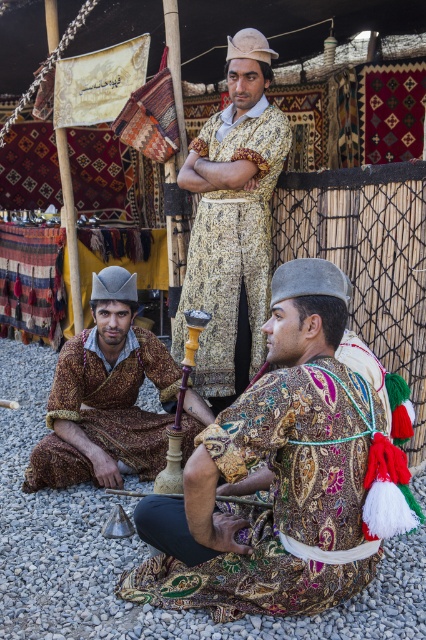
Does patterned fabric shisha at lower center have a smaller size compared to patterned fabric man at center?

No.

Which is more to the left, patterned fabric shisha at lower center or patterned fabric man at center?

From the viewer's perspective, patterned fabric man at center appears more on the left side.

Measure the distance between patterned fabric shisha at lower center and camera.

A distance of 9.41 feet exists between patterned fabric shisha at lower center and camera.

You are a GUI agent. You are given a task and a screenshot of the screen. Output one action in this format:
    pyautogui.click(x=<x>, y=<y>)
    Task: Click on the patterned fabric shisha at lower center
    This screenshot has width=426, height=640.
    Given the screenshot: What is the action you would take?
    pos(282,476)

Between patterned fabric shisha at lower center and matte brown robe at lower left, which one has less height?

Standing shorter between the two is matte brown robe at lower left.

Who is lower down, patterned fabric shisha at lower center or matte brown robe at lower left?

patterned fabric shisha at lower center is below.

The height and width of the screenshot is (640, 426). I want to click on patterned fabric shisha at lower center, so click(282, 476).

Consider the image. Can you confirm if patterned fabric man at center is positioned above matte brown robe at lower left?

Correct, patterned fabric man at center is located above matte brown robe at lower left.

Which is in front, point (209, 301) or point (109, 332)?

Point (109, 332) is more forward.

Locate an element on the screen. The width and height of the screenshot is (426, 640). patterned fabric man at center is located at coordinates (233, 221).